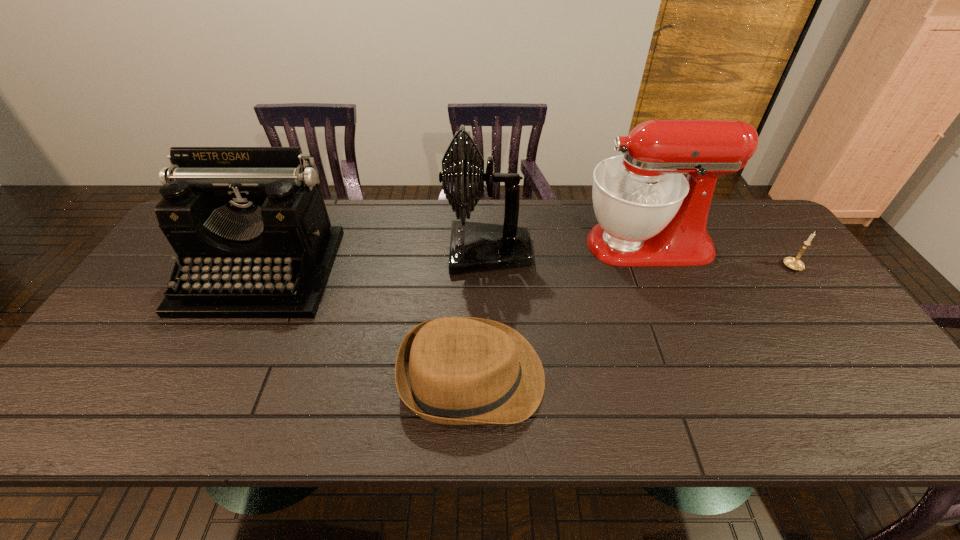
The width and height of the screenshot is (960, 540). I want to click on blank region between the candle holder and the fedora, so click(633, 322).

The height and width of the screenshot is (540, 960). Identify the location of vacant space that's between the fan and the mixer. point(566,248).

The image size is (960, 540). I want to click on vacant space in between the candle holder and the third tallest object, so click(x=527, y=269).

At what (x,y) coordinates should I click in order to perform the action: click on the second closest object to the mixer. Please return your answer as a coordinate pair (x, y). This screenshot has height=540, width=960. Looking at the image, I should click on (793, 263).

This screenshot has width=960, height=540. What are the coordinates of `object that stands as the closest to the fan` in the screenshot? It's located at (649, 214).

Locate an element on the screen. This screenshot has width=960, height=540. vacant space that satisfies the following two spatial constraints: 1. in front of the fan to blow air; 2. on the typing side of the leftmost object is located at coordinates (488, 271).

Identify the location of free space that satisfies the following two spatial constraints: 1. in front of the fan to blow air; 2. on the typing side of the third tallest object. (488, 271).